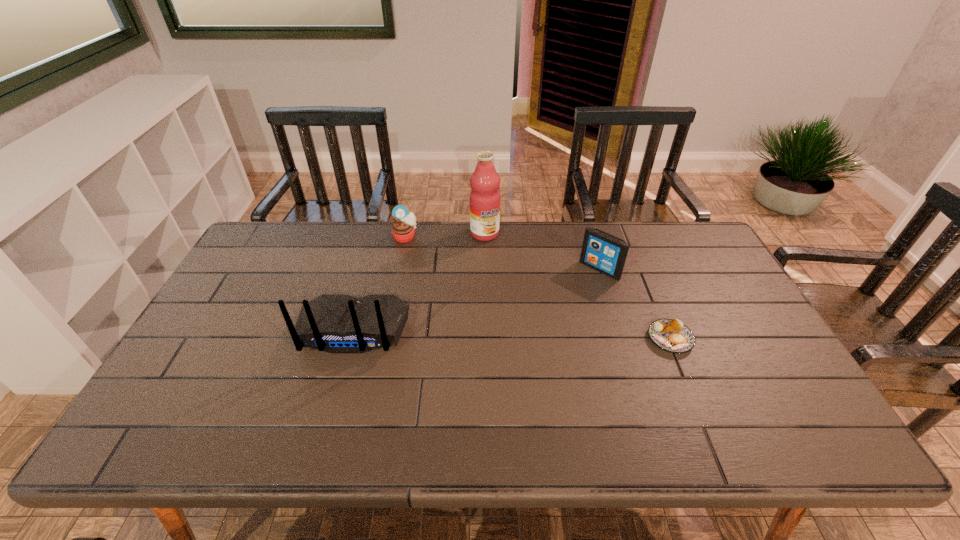
You are a GUI agent. You are given a task and a screenshot of the screen. Output one action in this format:
    pyautogui.click(x=<x>, y=<y>)
    Task: Click on the vacant space on the desktop that is between the second tallest object and the pastry and is positioned on the front-facing side of the muffin
    
    Given the screenshot: What is the action you would take?
    pyautogui.click(x=477, y=333)

The image size is (960, 540). I want to click on free space on the desktop that is between the fourth shortest object and the shortest object and is positioned on the label of the tallest object, so click(x=542, y=335).

Image resolution: width=960 pixels, height=540 pixels. I want to click on vacant spot on the desktop that is between the router and the pastry and is positioned on the front screen of the second object from right to left, so click(x=534, y=335).